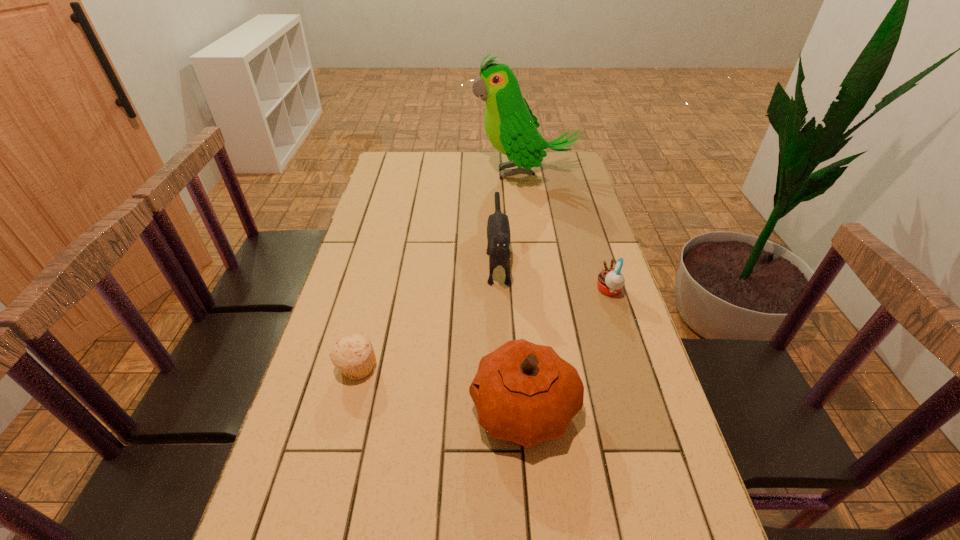
You are a GUI agent. You are given a task and a screenshot of the screen. Output one action in this format:
    pyautogui.click(x=<x>, y=<y>)
    Task: Click on the parakeet
    
    Given the screenshot: What is the action you would take?
    pyautogui.click(x=511, y=127)

You are a GUI agent. You are given a task and a screenshot of the screen. Output one action in this format:
    pyautogui.click(x=<x>, y=<y>)
    Task: Click on the tallest object
    
    Given the screenshot: What is the action you would take?
    pyautogui.click(x=511, y=127)

Locate an element on the screen. cat is located at coordinates (498, 229).

This screenshot has width=960, height=540. In order to click on pumpkin in this screenshot , I will do `click(523, 392)`.

Find the location of a particular element. Image resolution: width=960 pixels, height=540 pixels. the right muffin is located at coordinates click(610, 282).

You are a GUI agent. You are given a task and a screenshot of the screen. Output one action in this format:
    pyautogui.click(x=<x>, y=<y>)
    Task: Click on the shorter muffin
    This screenshot has width=960, height=540.
    Given the screenshot: What is the action you would take?
    pyautogui.click(x=354, y=355)

What are the coordinates of `the left muffin` in the screenshot? It's located at (354, 355).

This screenshot has height=540, width=960. I want to click on free spot located on the beak of the tallest object, so click(x=444, y=173).

Find the location of `vacant region located on the beak of the tallest object`. vacant region located on the beak of the tallest object is located at coordinates (442, 173).

The height and width of the screenshot is (540, 960). Find the location of `vacant region located 0.390m on the beak of the tallest object`. vacant region located 0.390m on the beak of the tallest object is located at coordinates (377, 173).